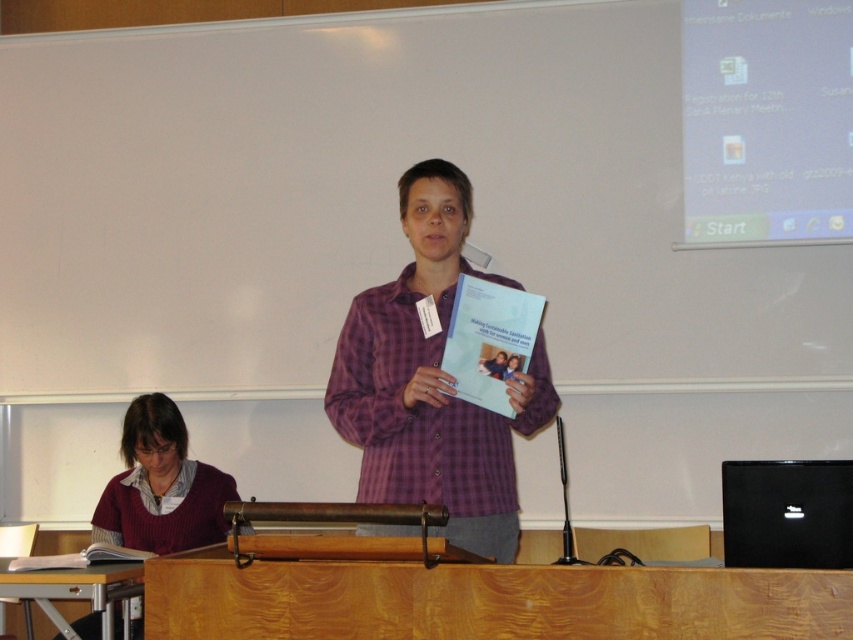
Who is more distant from viewer, (419, 346) or (129, 436)?

Point (129, 436)

Does point (389, 493) lie in front of point (136, 506)?

Yes.

Is point (422, 275) positioned behind point (201, 513)?

No, it is in front of (201, 513).

In order to click on purple checkered shirt at center in this screenshot , I will do `click(432, 381)`.